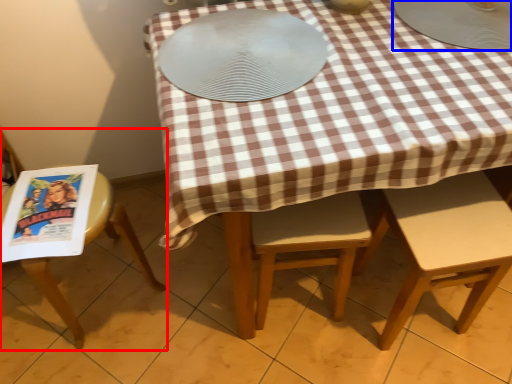
Question: Which object is closer to the camera taking this photo, chair (highlighted by a red box) or tableware (highlighted by a blue box)?

Choices:
 (A) chair
 (B) tableware

Answer: (B)